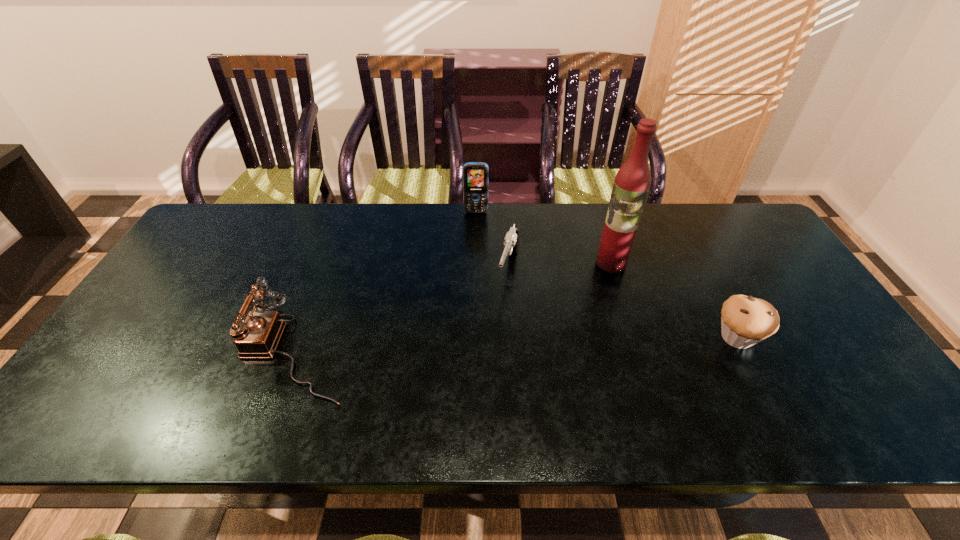
You are a GUI agent. You are given a task and a screenshot of the screen. Output one action in this format:
    pyautogui.click(x=<x>, y=<y>)
    Task: Click on the free space between the gun and the leftmost object
    This screenshot has height=540, width=960.
    Given the screenshot: What is the action you would take?
    pyautogui.click(x=401, y=310)

The height and width of the screenshot is (540, 960). I want to click on free spot between the cellular telephone and the gun, so click(492, 240).

Find the location of a particular element. The width and height of the screenshot is (960, 540). free space between the fourth object from left to right and the telephone is located at coordinates (452, 307).

Locate an element on the screen. This screenshot has width=960, height=540. free space between the leftmost object and the farthest object is located at coordinates (384, 281).

Where is `vacant space that's between the second tallest object and the liquor`? vacant space that's between the second tallest object and the liquor is located at coordinates (543, 237).

Image resolution: width=960 pixels, height=540 pixels. I want to click on vacant region between the telephone and the gun, so click(x=401, y=310).

Locate an element on the screen. The image size is (960, 540). vacant area that lies between the telephone and the fourth object from left to right is located at coordinates (452, 307).

In order to click on free spot between the telephone and the liquor in this screenshot , I will do `click(452, 307)`.

Locate an element on the screen. This screenshot has width=960, height=540. vacant area that lies between the muffin and the tallest object is located at coordinates (674, 300).

Select which object is the third closest to the muffin. Please provide its 2D coordinates. Your answer should be formatted as a tuple, i.e. [(x, y)], where the tuple contains the x and y coordinates of a point satisfying the conditions above.

[(475, 174)]